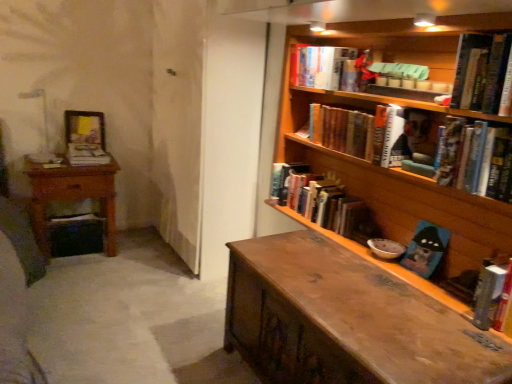
Question: In terms of height, does wooden picture frame at upper left look taller or shorter compared to hardcover book at upper right, the fourth book from the left?

Choices:
 (A) tall
 (B) short

Answer: (A)

Question: In the image, is wooden picture frame at upper left on the left side or the right side of hardcover book at upper right, the fourth book from the left?

Choices:
 (A) left
 (B) right

Answer: (A)

Question: Which is farther from the hardcover book at upper right, the 3th book positioned from the right?

Choices:
 (A) wooden bookshelf at upper right
 (B) hardcover book at right, arranged as the first book when viewed from the right
 (C) wooden nightstand at left
 (D) wooden desk at center
 (E) hardcover book at upper center, which is counted as the second book, starting from the left

Answer: (C)

Question: Estimate the real-world distances between objects in this image. Which object is closer to the wooden desk at center?

Choices:
 (A) hardcover book at upper center, which is counted as the second book, starting from the left
 (B) wooden nightstand at left
 (C) white matte book at left, which is the seventh book from right to left
 (D) hardcover book at upper right, which appears as the 2th book when viewed from the right
 (E) wooden bookshelf at upper right

Answer: (E)